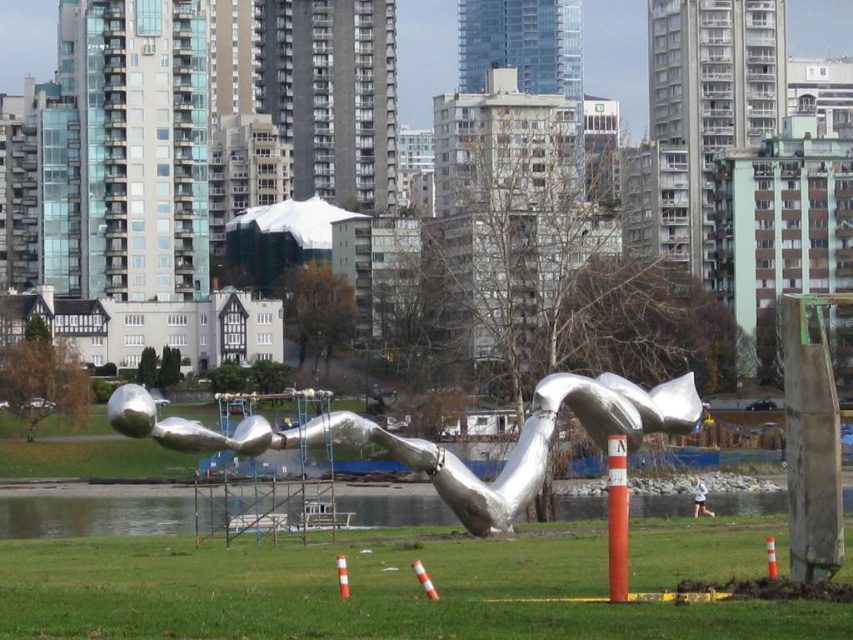
Question: Which object appears farthest from the camera in this image?

Choices:
 (A) silver metallic sculpture at center
 (B) orange traffic cone at center
 (C) orange striped traffic cone at center
 (D) orange reflective cone at center

Answer: (A)

Question: Does orange matte pole at center lie behind orange striped traffic cone at center?

Choices:
 (A) no
 (B) yes

Answer: (A)

Question: Can you confirm if orange matte pole at center is thinner than orange striped traffic cone at center?

Choices:
 (A) yes
 (B) no

Answer: (B)

Question: Which object appears closest to the camera in this image?

Choices:
 (A) orange reflective cone at center
 (B) orange striped traffic cone at center

Answer: (A)

Question: Can you confirm if orange matte pole at center is bigger than orange traffic cone at center?

Choices:
 (A) no
 (B) yes

Answer: (B)

Question: Which object appears closest to the camera in this image?

Choices:
 (A) green grass at center
 (B) orange reflective cone at center

Answer: (A)